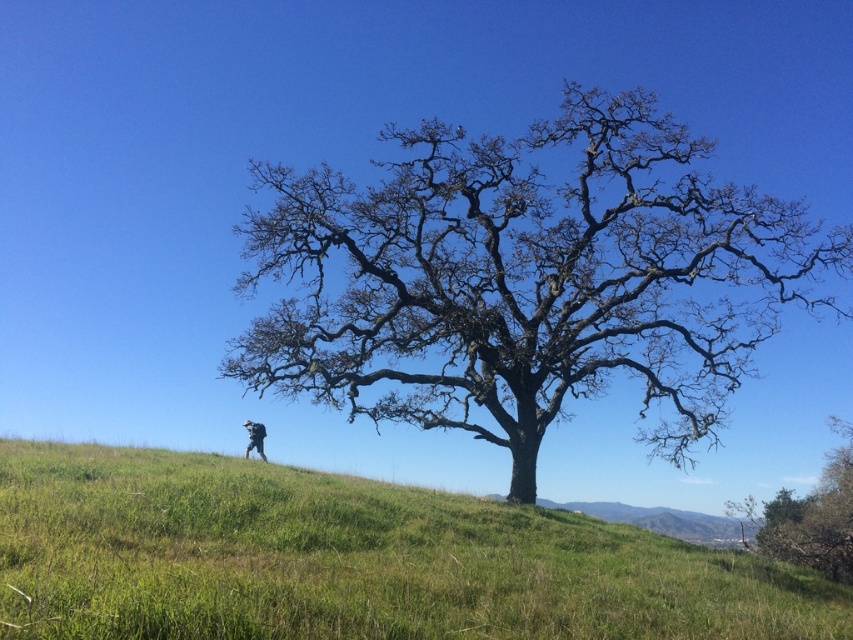
Is smooth bark tree at right bigger than camouflage fabric jacket at lower center?

Yes, smooth bark tree at right is bigger than camouflage fabric jacket at lower center.

Can you confirm if smooth bark tree at right is taller than camouflage fabric jacket at lower center?

Yes.

Locate an element on the screen. smooth bark tree at right is located at coordinates (810, 516).

From the picture: Is bare branches at center below smooth bark tree at right?

No, bare branches at center is not below smooth bark tree at right.

The width and height of the screenshot is (853, 640). In order to click on bare branches at center in this screenshot , I will do `click(526, 280)`.

Who is more distant from viewer, (364, 344) or (253, 429)?

The point (253, 429) is more distant.

Is bare branches at center to the right of camouflage fabric jacket at lower center from the viewer's perspective?

Correct, you'll find bare branches at center to the right of camouflage fabric jacket at lower center.

Is point (701, 317) closer to viewer compared to point (260, 449)?

No, (701, 317) is further to viewer.

Locate an element on the screen. The image size is (853, 640). bare branches at center is located at coordinates (526, 280).